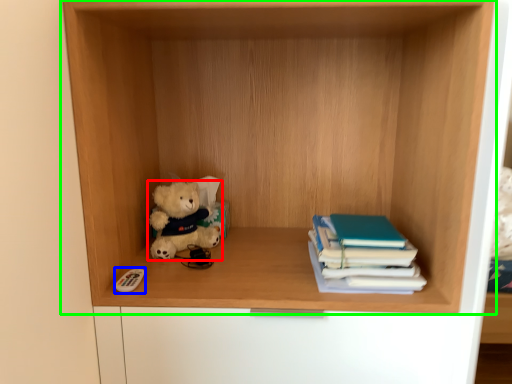
Question: Which object is the farthest from teddy bear (highlighted by a red box)? Choose among these: toy (highlighted by a blue box) or shelf (highlighted by a green box).

Choices:
 (A) toy
 (B) shelf

Answer: (B)